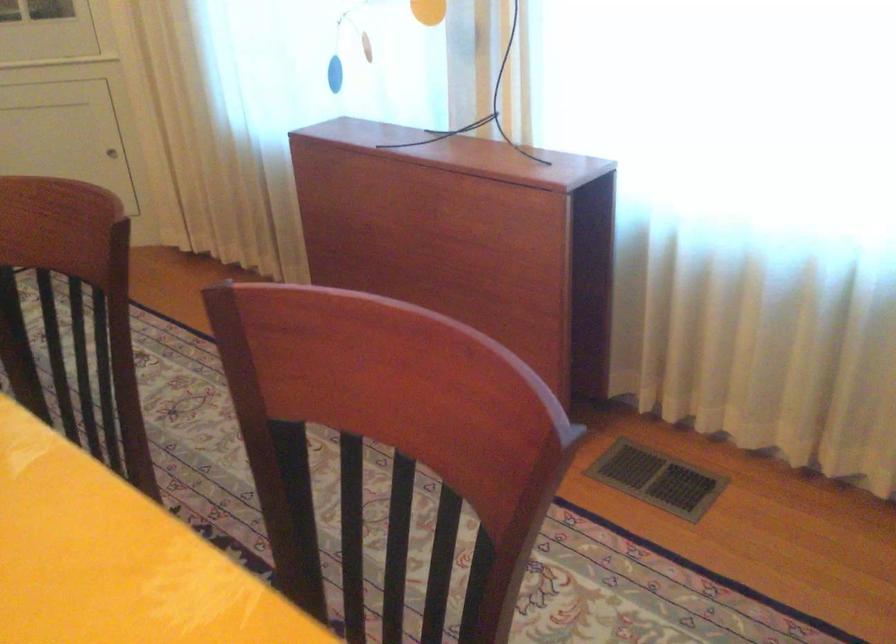
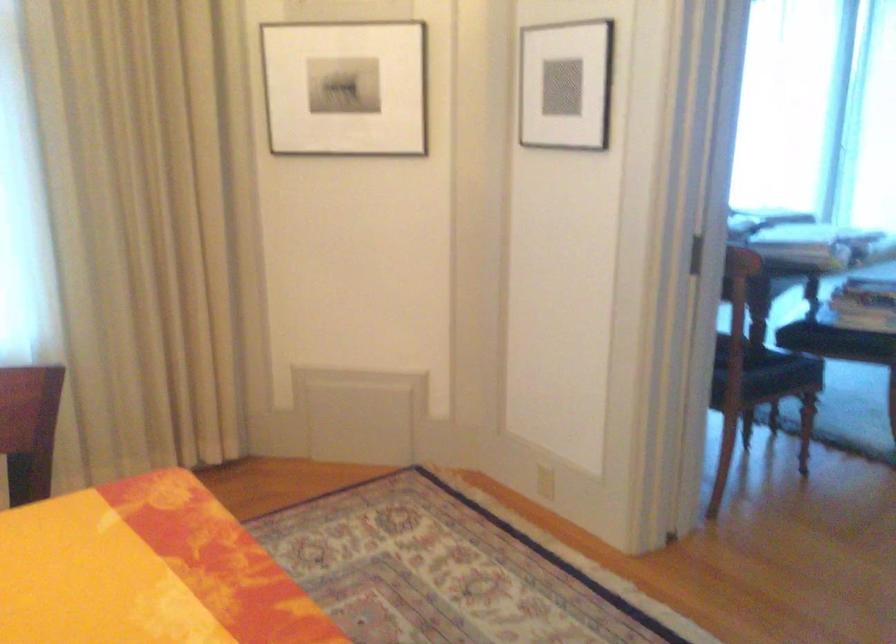
Question: The first image is from the beginning of the video and the second image is from the end. How did the camera likely rotate when shooting the video?

Choices:
 (A) Left
 (B) Right
 (C) Up
 (D) Down

Answer: (B)